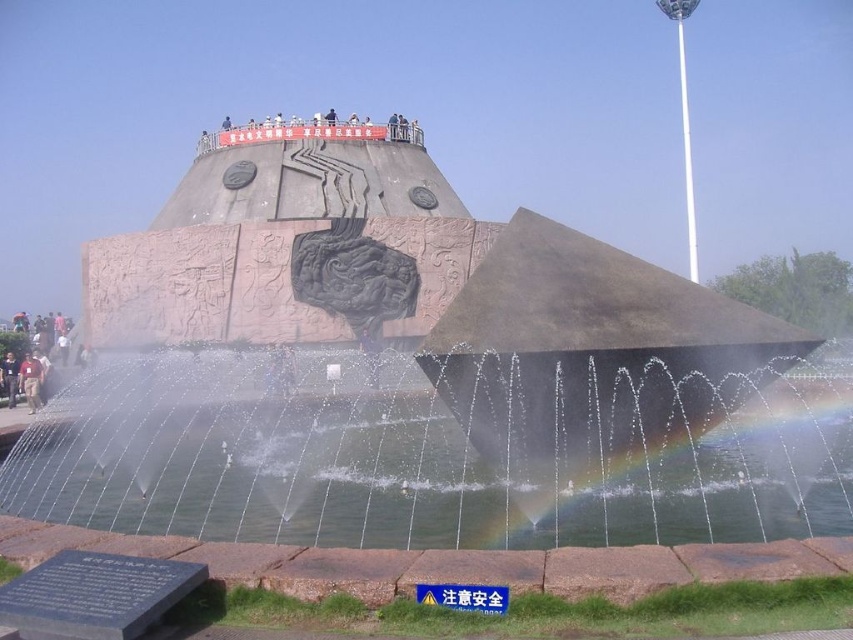
Question: Does metallic fountain at center have a larger size compared to clear water at fountain center?

Choices:
 (A) yes
 (B) no

Answer: (A)

Question: Which object is closer to the camera taking this photo?

Choices:
 (A) clear water at fountain center
 (B) metallic fountain at center

Answer: (A)

Question: Which of the following is the closest to the observer?

Choices:
 (A) clear water at fountain center
 (B) metallic fountain at center

Answer: (A)

Question: Is the position of metallic fountain at center more distant than that of clear water at fountain center?

Choices:
 (A) no
 (B) yes

Answer: (B)

Question: Which of the following is the closest to the observer?

Choices:
 (A) (756, 371)
 (B) (463, 461)

Answer: (A)

Question: Observing the image, what is the correct spatial positioning of metallic fountain at center in reference to clear water at fountain center?

Choices:
 (A) left
 (B) right

Answer: (B)